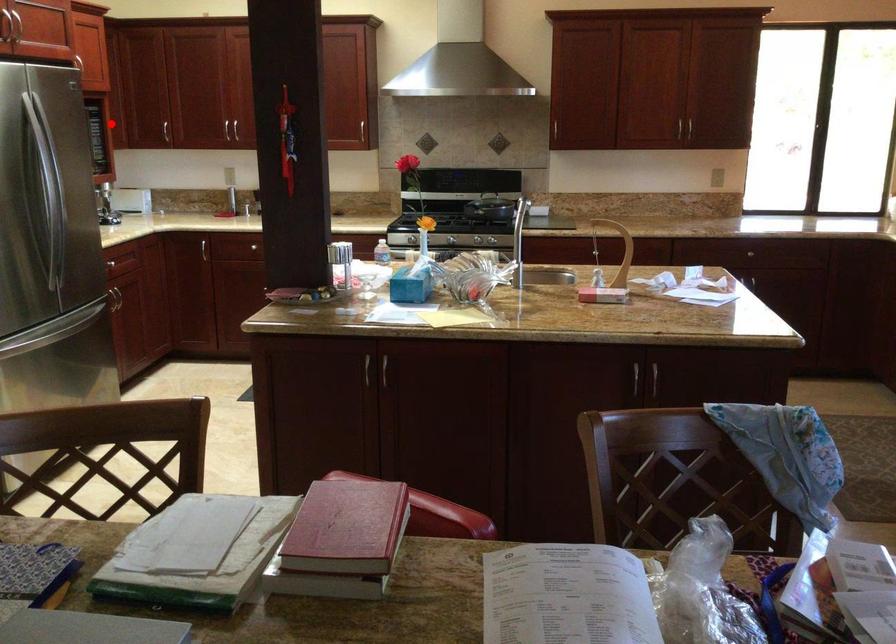
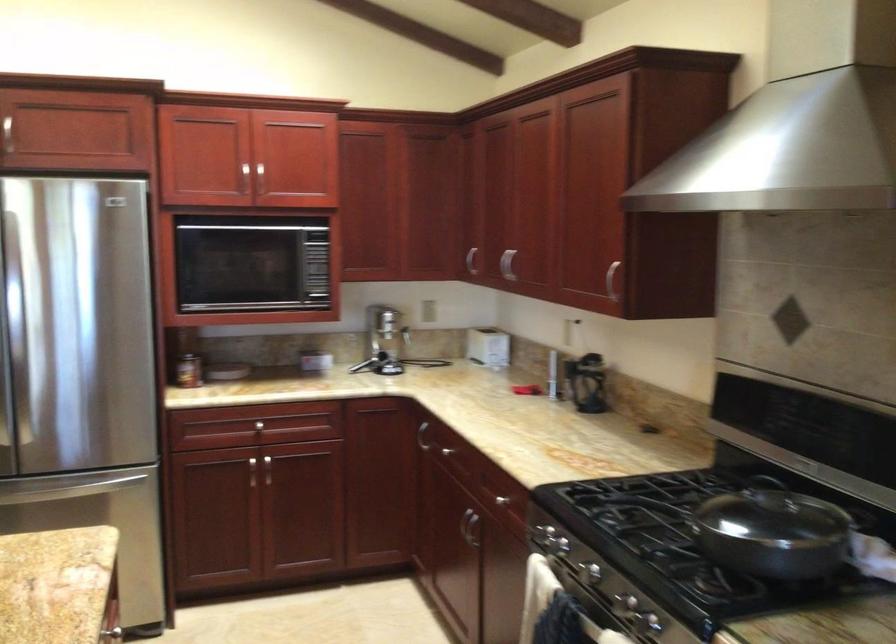
In the second image, find the point that corresponds to the highlighted location in the first image.

(471, 261)